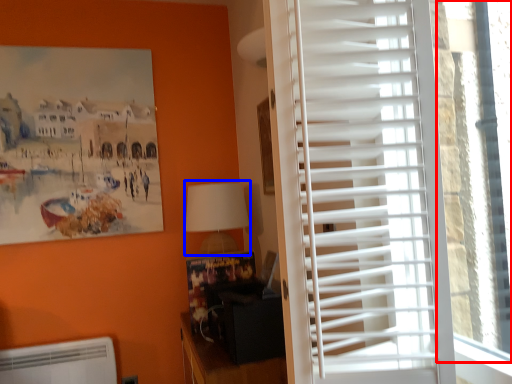
Question: Which point is further to the camera, window screen (highlighted by a red box) or table lamp (highlighted by a blue box)?

Choices:
 (A) window screen
 (B) table lamp

Answer: (B)